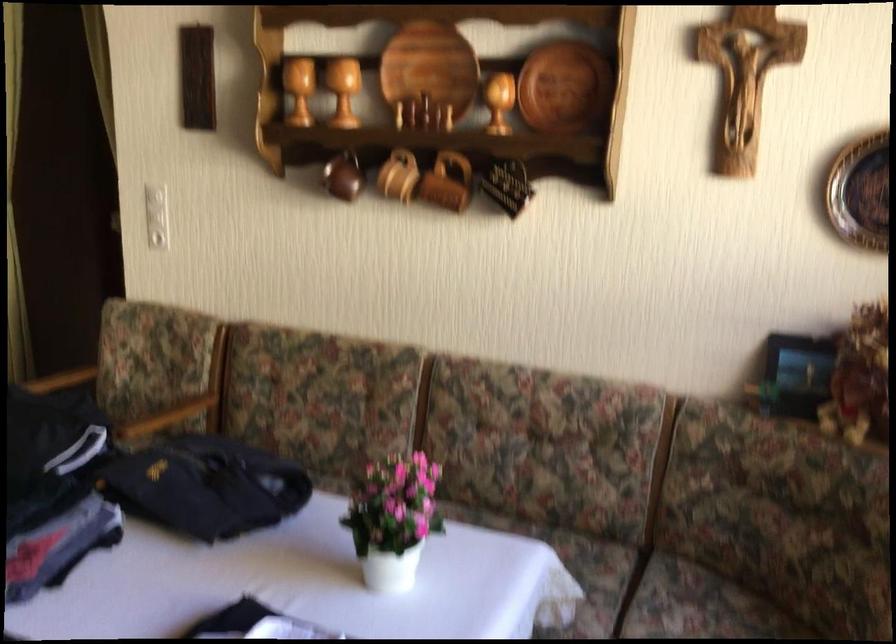
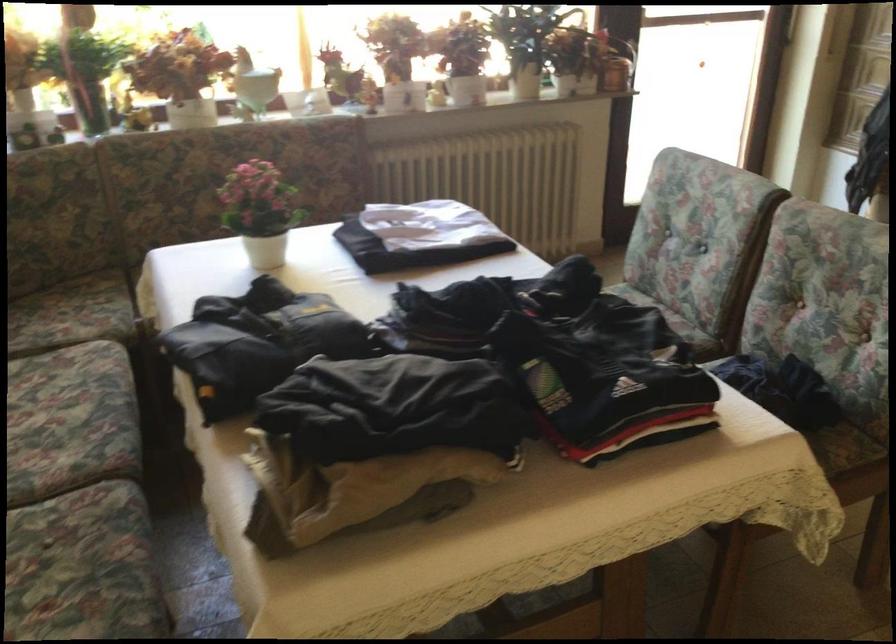
In the second image, find the point that corresponds to point 399,504 in the first image.

(261, 212)